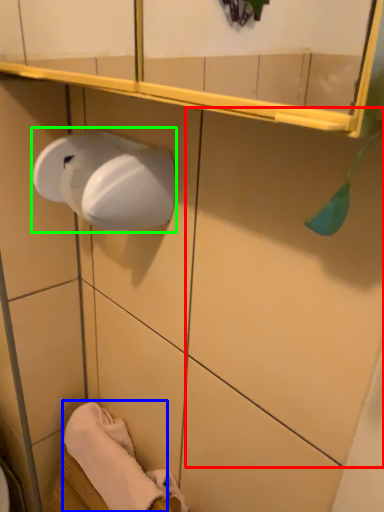
Question: Estimate the real-world distances between objects in this image. Which object is farther from tile (highlighted by a red box), bath towel (highlighted by a blue box) or paper towel (highlighted by a green box)?

Choices:
 (A) bath towel
 (B) paper towel

Answer: (A)